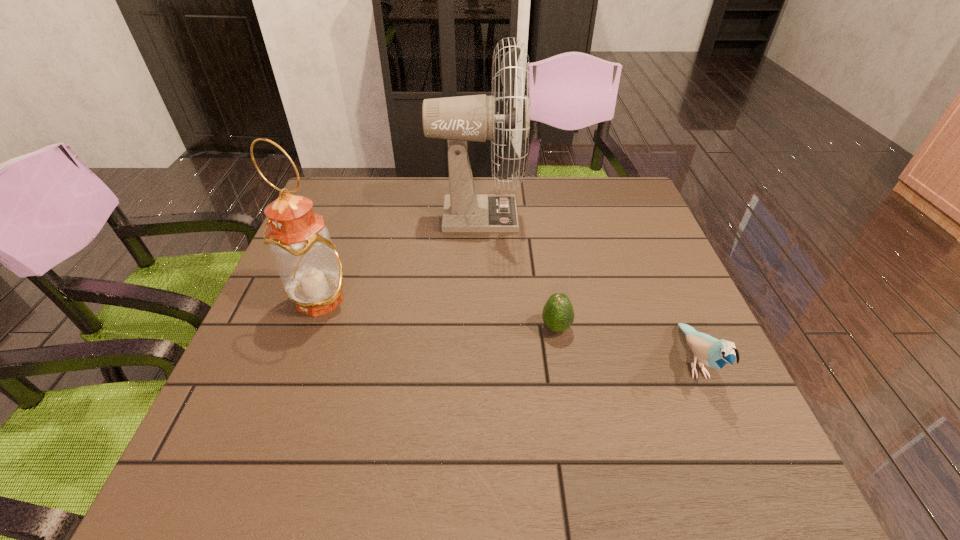
Point out which object is positioned as the third nearest to the second object from right to left. Please provide its 2D coordinates. Your answer should be formatted as a tuple, i.e. [(x, y)], where the tuple contains the x and y coordinates of a point satisfying the conditions above.

[(310, 269)]

Find the location of a particular element. The width and height of the screenshot is (960, 540). the third closest object relative to the fan is located at coordinates (712, 352).

Locate an element on the screen. This screenshot has width=960, height=540. vacant position in the image that satisfies the following two spatial constraints: 1. on the air flow direction of the shortest object; 2. on the right side of the farthest object is located at coordinates (475, 328).

Locate an element on the screen. Image resolution: width=960 pixels, height=540 pixels. vacant area in the image that satisfies the following two spatial constraints: 1. on the back side of the avocado; 2. on the air flow direction of the fan is located at coordinates (538, 215).

Locate an element on the screen. The width and height of the screenshot is (960, 540). free location that satisfies the following two spatial constraints: 1. on the air flow direction of the avocado; 2. on the left side of the fan is located at coordinates (475, 328).

Where is `free location that satisfies the following two spatial constraints: 1. on the air flow direction of the third object from right to left; 2. on the left side of the shortest object`? free location that satisfies the following two spatial constraints: 1. on the air flow direction of the third object from right to left; 2. on the left side of the shortest object is located at coordinates (475, 328).

This screenshot has height=540, width=960. I want to click on free space in the image that satisfies the following two spatial constraints: 1. on the air flow direction of the farthest object; 2. on the back side of the shortest object, so click(x=475, y=328).

At what (x,y) coordinates should I click in order to perform the action: click on free spot that satisfies the following two spatial constraints: 1. on the air flow direction of the third object from right to left; 2. on the left side of the avocado. Please return your answer as a coordinate pair (x, y). The width and height of the screenshot is (960, 540). Looking at the image, I should click on [x=475, y=328].